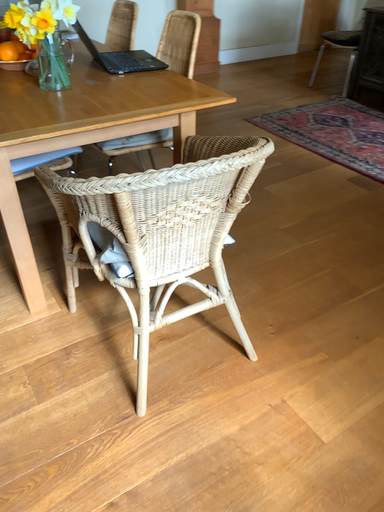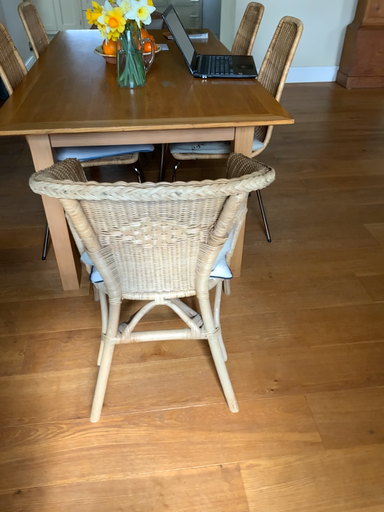
Question: Which way did the camera rotate in the video?

Choices:
 (A) rotated right
 (B) rotated left

Answer: (B)